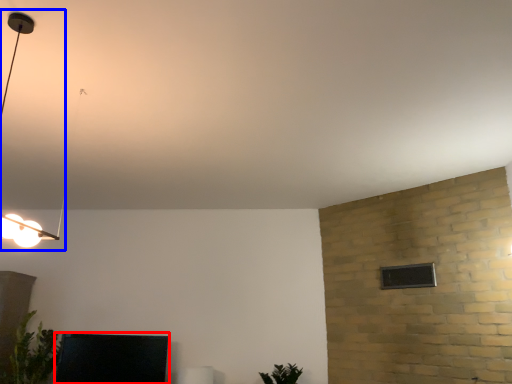
Question: Which point is further to the camera, furniture (highlighted by a red box) or lamp (highlighted by a blue box)?

Choices:
 (A) furniture
 (B) lamp

Answer: (A)